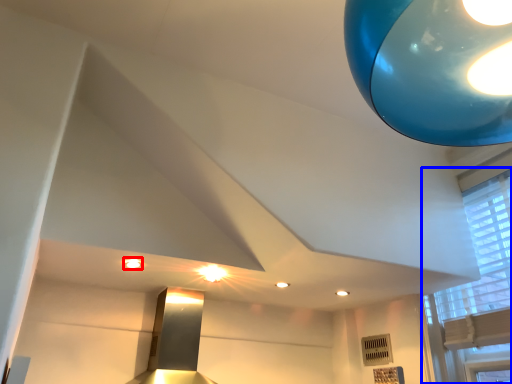
Question: Among these objects, which one is nearest to the camera, lighting (highlighted by a red box) or window (highlighted by a blue box)?

Choices:
 (A) lighting
 (B) window

Answer: (B)